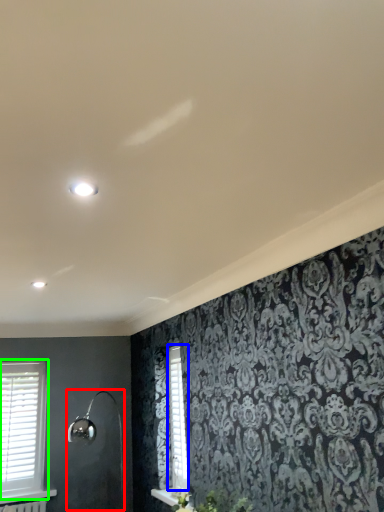
Question: Considering the real-world distances, which object is closest to shower (highlighted by a red box)? shutter (highlighted by a blue box) or window (highlighted by a green box).

Choices:
 (A) shutter
 (B) window

Answer: (B)